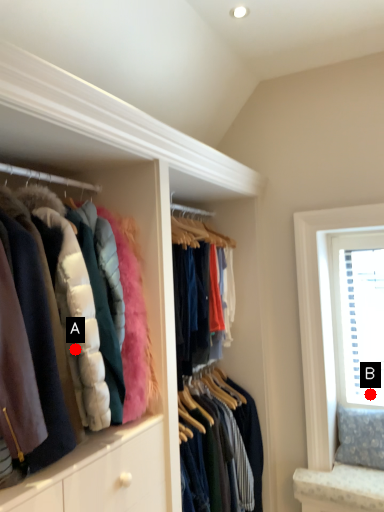
Question: Two points are circled on the image, labeled by A and B beside each circle. Which point is further to the camera?

Choices:
 (A) A is further
 (B) B is further

Answer: (B)